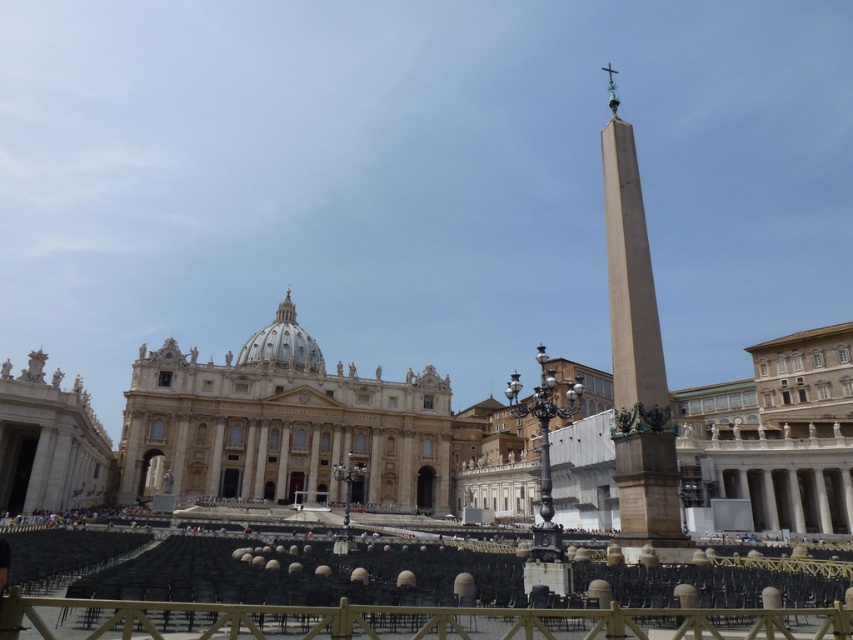
You are standing in the plaza in front of the grand building. You see the wooden at center and the brown stone obelisk at right. Which object is closer to the ground?

The wooden at center is closer to the ground because it is positioned below the brown stone obelisk at right.

You are organizing a small event in the plaza and need to place a decorative banner between the wooden at center and the brown stone obelisk at right. Since the banner must be placed centrally between them, which object should you align the banner closer to to ensure it is centered?

The banner should be aligned closer to the brown stone obelisk at right because the wooden at center is wider than the brown stone obelisk at right, so the center point between them would be nearer to the narrower object.